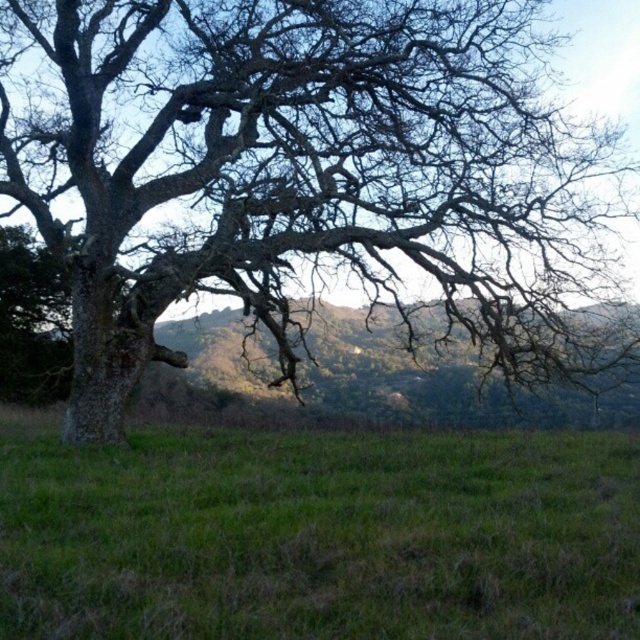
Question: Is bare wood tree at left smaller than green grassy field at center?

Choices:
 (A) yes
 (B) no

Answer: (B)

Question: Is bare wood tree at left to the right of green grassy field at center from the viewer's perspective?

Choices:
 (A) yes
 (B) no

Answer: (B)

Question: Which of the following is the farthest from the observer?

Choices:
 (A) bare wood tree at left
 (B) green grassy field at center

Answer: (A)

Question: Does bare wood tree at left appear on the right side of green grassy field at center?

Choices:
 (A) yes
 (B) no

Answer: (B)

Question: Among these points, which one is farthest from the camera?

Choices:
 (A) (380, 477)
 (B) (512, 321)

Answer: (B)